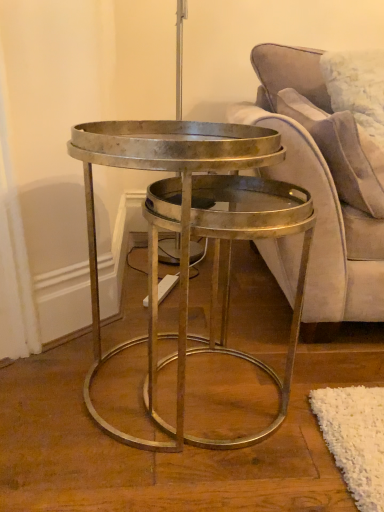
Question: Considering their positions, is metallic/golden coffee table at center located in front of or behind velvet purple couch at right?

Choices:
 (A) behind
 (B) front

Answer: (B)

Question: Based on their sizes in the image, would you say metallic/golden coffee table at center is bigger or smaller than velvet purple couch at right?

Choices:
 (A) small
 (B) big

Answer: (A)

Question: Considering the real-world distances, which object is closest to the metallic/golden coffee table at center?

Choices:
 (A) velvet purple couch at right
 (B) suede-like beige pillow at upper right

Answer: (A)

Question: Which object is the farthest from the velvet purple couch at right?

Choices:
 (A) suede-like beige pillow at upper right
 (B) metallic/golden coffee table at center

Answer: (B)